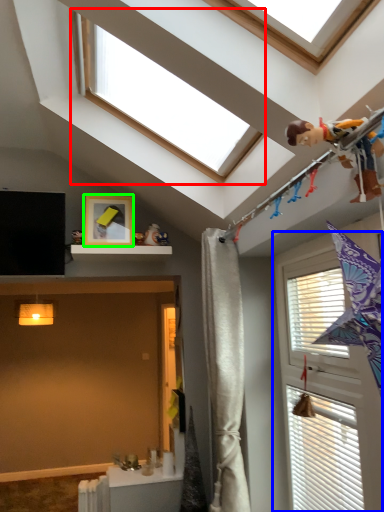
Question: Which object is the closest to the window (highlighted by a red box)? Choose among these: window (highlighted by a blue box) or picture frame (highlighted by a green box).

Choices:
 (A) window
 (B) picture frame

Answer: (B)